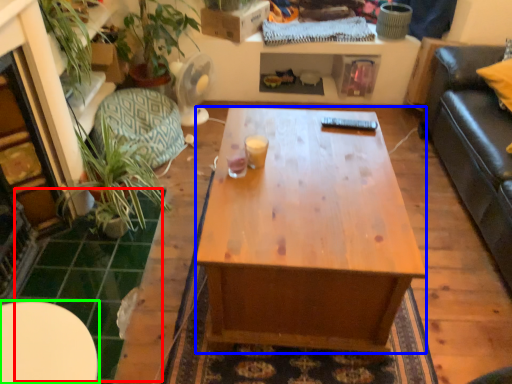
Question: Considering the real-world distances, which object is farthest from tile (highlighted by a red box)? desk (highlighted by a blue box) or table (highlighted by a green box)?

Choices:
 (A) desk
 (B) table

Answer: (A)